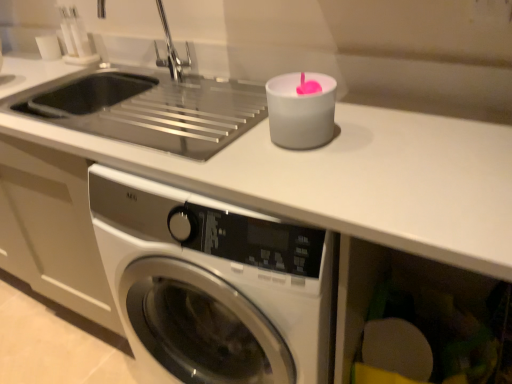
Image resolution: width=512 pixels, height=384 pixels. I want to click on free spot to the right of white matte candle at upper right, so click(359, 127).